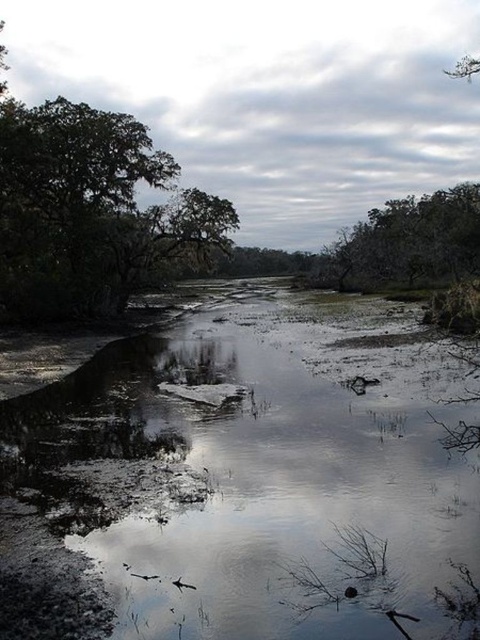
You are planning to build a small treehouse and need to choose between the green leafy tree at upper left and the green leafy tree at upper right. Based on their sizes, which tree would be more suitable for supporting a treehouse?

The green leafy tree at upper left is taller than the green leafy tree at upper right, making it more suitable for supporting a treehouse due to its greater height and likely stronger structure.

You are standing at the edge of the river on the left side near the tree with Spanish moss. You want to cross to the point marked by the coordinates point [238,480]. Is this point located in the muddy water at center?

Yes, the point [238,480] corresponds to muddy water at center, so it is located in the muddy water at center.

You are a small frog trying to jump from the green leafy tree at upper left to the muddy water at center. Based on the scene, can you safely make the jump without falling into the water?

The muddy water at center has a lesser width compared to the green leafy tree at upper left, so the distance between them is manageable for the frog to jump safely from the green leafy tree at upper left to the muddy water at center.